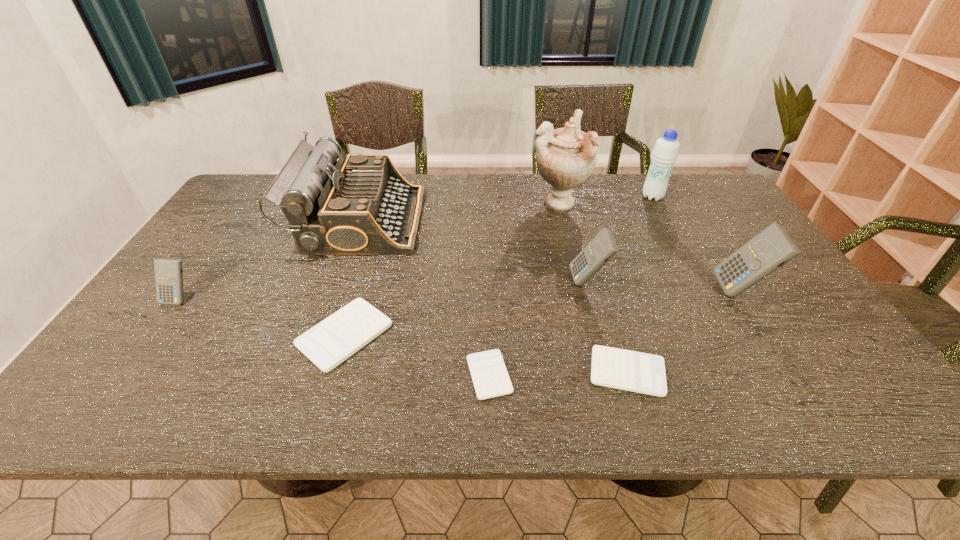
At what (x,y) coordinates should I click in order to perform the action: click on urn. Please return your answer as a coordinate pair (x, y). The height and width of the screenshot is (540, 960). Looking at the image, I should click on (566, 157).

What are the coordinates of `water bottle` in the screenshot? It's located at (665, 152).

Image resolution: width=960 pixels, height=540 pixels. What are the coordinates of `typewriter` in the screenshot? It's located at coord(361,204).

Identify the location of the biggest blue calculator. (772, 248).

The height and width of the screenshot is (540, 960). What are the coordinates of `the tallest calculator` in the screenshot? It's located at (772, 248).

The width and height of the screenshot is (960, 540). What are the coordinates of `the fifth shortest calculator` in the screenshot? It's located at (603, 247).

Find the location of `the second blue calculator from right to left`. the second blue calculator from right to left is located at coordinates (603, 247).

What are the coordinates of `the leftmost blue calculator` in the screenshot? It's located at (168, 272).

Locate an element on the screen. Image resolution: width=960 pixels, height=540 pixels. the sixth tallest object is located at coordinates (168, 272).

Find the location of a particular element. the third shortest object is located at coordinates (336, 338).